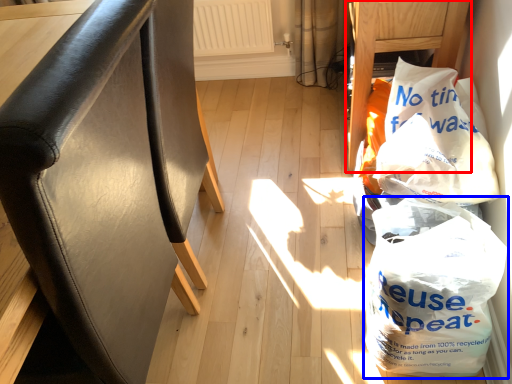
Question: Which of the following is the closest to the observer, furniture (highlighted by a red box) or plastic bag (highlighted by a blue box)?

Choices:
 (A) furniture
 (B) plastic bag

Answer: (B)